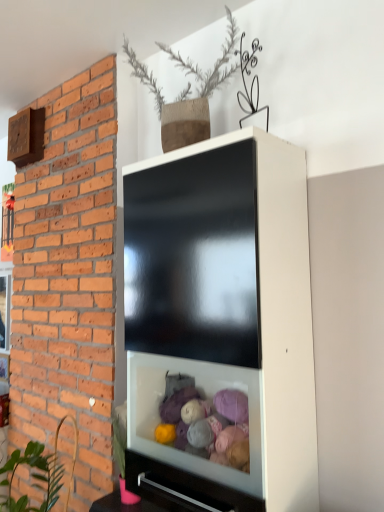
This screenshot has height=512, width=384. Identify the location of bare twigs at upper center. (211, 68).

The image size is (384, 512). What do you see at coordinates (211, 68) in the screenshot?
I see `bare twigs at upper center` at bounding box center [211, 68].

The height and width of the screenshot is (512, 384). Identify the location of bare twigs at upper center. (211, 68).